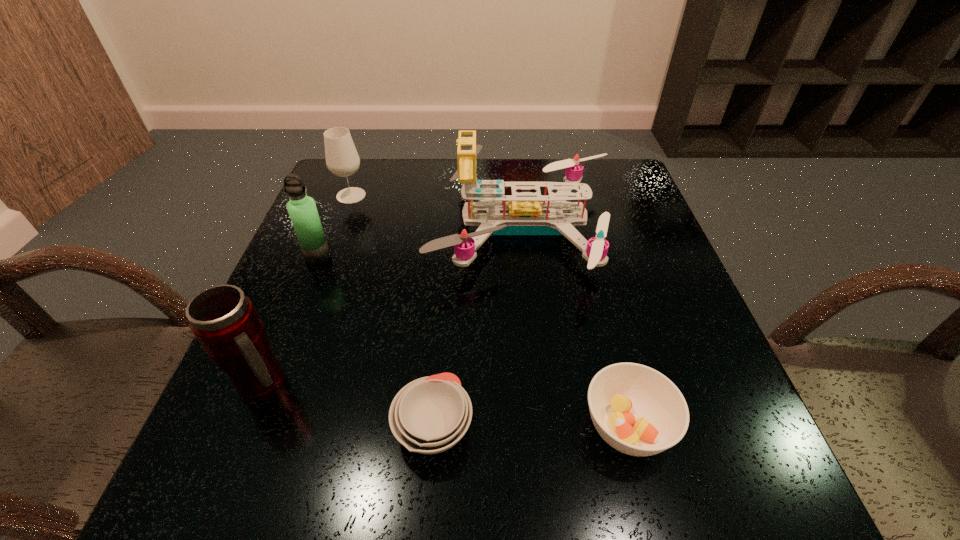
The height and width of the screenshot is (540, 960). Identify the location of drone. (520, 215).

You are a GUI agent. You are given a task and a screenshot of the screen. Output one action in this format:
    pyautogui.click(x=<x>, y=<y>)
    Task: Click on the farther thermos bottle
    The width and height of the screenshot is (960, 540).
    Given the screenshot: What is the action you would take?
    pyautogui.click(x=302, y=210)

In order to click on the nearer thermos bottle in this screenshot , I will do `click(225, 321)`.

Find the location of a particular element. glass is located at coordinates (342, 159).

Find the location of a particular element. Image resolution: width=960 pixels, height=540 pixels. the right soup bowl is located at coordinates (638, 411).

I want to click on the shortest object, so click(429, 415).

This screenshot has height=540, width=960. I want to click on the shorter soup bowl, so click(x=429, y=415).

Locate an element on the screen. This screenshot has width=960, height=540. vacant space located 0.250m on the front-facing side of the drone is located at coordinates (325, 228).

This screenshot has height=540, width=960. What are the coordinates of `blank space located on the front-facing side of the drone` in the screenshot? It's located at (384, 228).

At what (x,y) coordinates should I click in order to perform the action: click on free space located on the front-facing side of the drone. Please return your answer as a coordinate pair (x, y). Looking at the image, I should click on (350, 228).